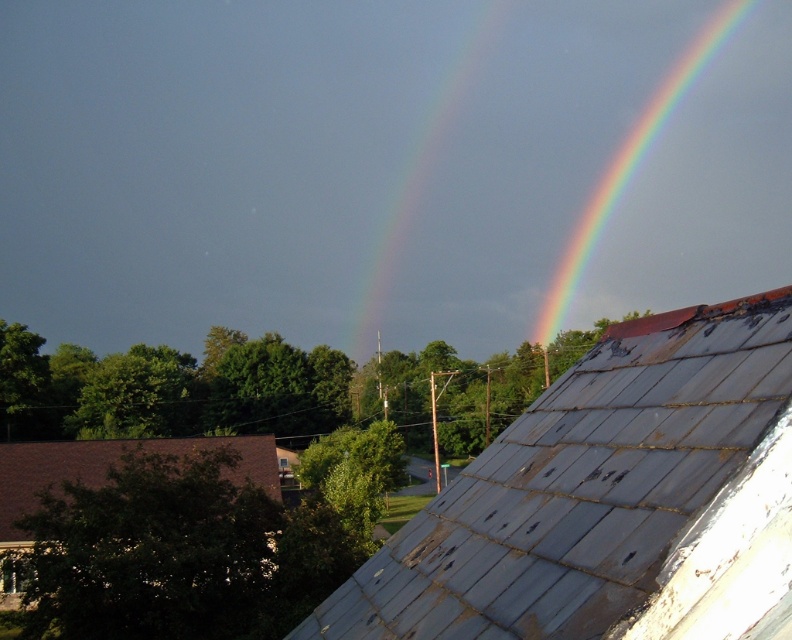
Is brown shingles at lower left smaller than rainbow at upper right?

Indeed, brown shingles at lower left has a smaller size compared to rainbow at upper right.

Can you confirm if brown shingles at lower left is shorter than rainbow at upper right?

Yes.

Who is more forward, (x=59, y=456) or (x=604, y=211)?

Positioned in front is point (x=59, y=456).

This screenshot has height=640, width=792. Identify the location of brown shingles at lower left. (109, 467).

Can you confirm if rusty metal roof at upper right is positioned to the left of rainbow at upper right?

Indeed, rusty metal roof at upper right is positioned on the left side of rainbow at upper right.

Based on the photo, can you confirm if rusty metal roof at upper right is bigger than rainbow at upper right?

Actually, rusty metal roof at upper right might be smaller than rainbow at upper right.

Is point (532, 474) positioned in front of point (619, 193)?

Yes, point (532, 474) is in front of point (619, 193).

Identify the location of rusty metal roof at upper right. The height and width of the screenshot is (640, 792). (610, 500).

Does rusty metal roof at upper right appear on the right side of brown shingles at lower left?

Indeed, rusty metal roof at upper right is positioned on the right side of brown shingles at lower left.

Does rusty metal roof at upper right have a lesser width compared to brown shingles at lower left?

Result: Indeed, rusty metal roof at upper right has a lesser width compared to brown shingles at lower left.

Who is more forward, [682,572] or [56,442]?

Point [682,572] is in front.

Where is `rusty metal roof at upper right`? rusty metal roof at upper right is located at coordinates (610, 500).